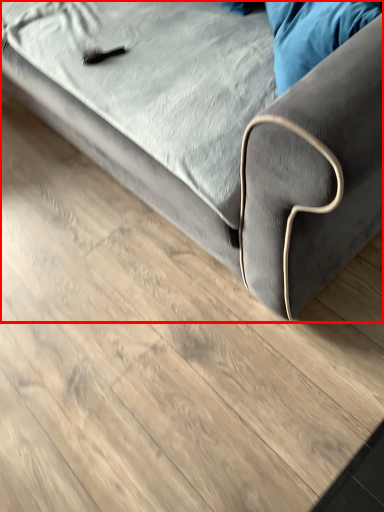
Question: From the image's perspective, what is the correct spatial relationship of studio couch (annotated by the red box) in relation to pillow?

Choices:
 (A) above
 (B) below

Answer: (A)